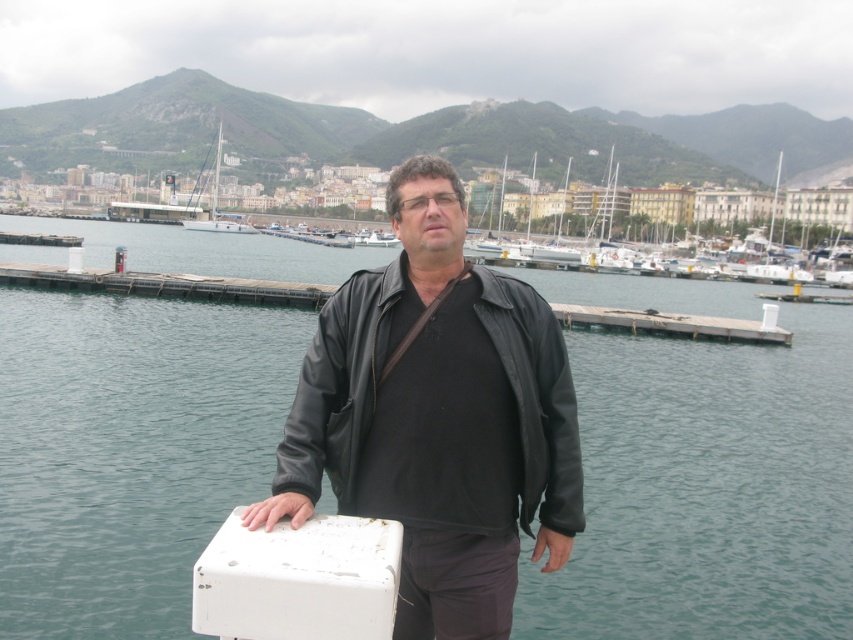
Question: Does black leather jacket at center come behind white glossy boat at center?

Choices:
 (A) no
 (B) yes

Answer: (A)

Question: Can you confirm if wooden dock at center is thinner than white glossy boat at center?

Choices:
 (A) yes
 (B) no

Answer: (A)

Question: Which is nearer to the wooden dock at center?

Choices:
 (A) white glossy sailboat at upper left
 (B) transparent water at center
 (C) white glossy boat at center
 (D) white plastic boat at upper right

Answer: (B)

Question: Which of the following is the farthest from the observer?

Choices:
 (A) transparent water at center
 (B) white glossy boat at center

Answer: (B)

Question: Is wooden dock at center closer to camera compared to white glossy boat at center?

Choices:
 (A) no
 (B) yes

Answer: (B)

Question: Which point is closer to the camera taking this photo?

Choices:
 (A) (740, 340)
 (B) (500, 621)
 (C) (640, 240)
 (D) (209, 227)

Answer: (B)